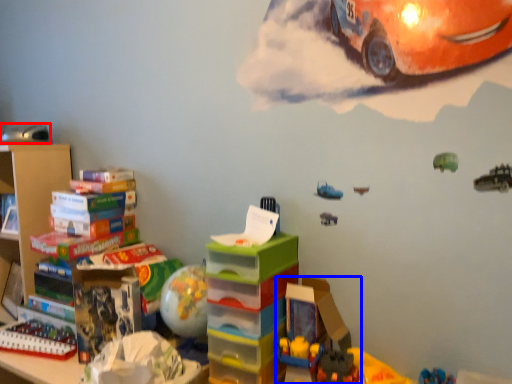
Question: Which point is closer to the camera, toy (highlighted by a red box) or toy (highlighted by a blue box)?

Choices:
 (A) toy
 (B) toy

Answer: (B)